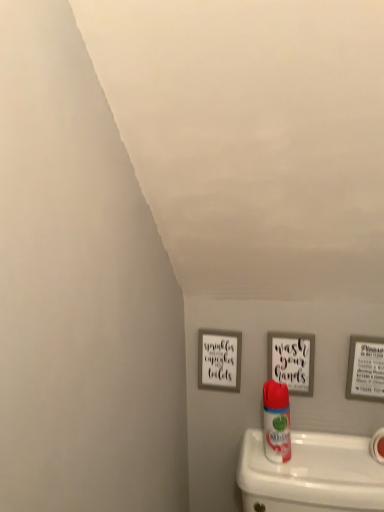
Question: From a real-world perspective, does wooden sign at center, which is the second picture frame from left to right, sit lower than white glossy air freshener at center?

Choices:
 (A) no
 (B) yes

Answer: (A)

Question: Does wooden sign at center, acting as the second picture frame starting from the right, appear on the left side of white glossy air freshener at center?

Choices:
 (A) yes
 (B) no

Answer: (B)

Question: From the image's perspective, does wooden sign at center, acting as the second picture frame starting from the right, appear lower than white glossy air freshener at center?

Choices:
 (A) no
 (B) yes

Answer: (A)

Question: Is wooden sign at center, which is the second picture frame from left to right, next to white glossy air freshener at center and touching it?

Choices:
 (A) no
 (B) yes

Answer: (A)

Question: From the image's perspective, is wooden sign at center, which is the second picture frame from left to right, on white glossy air freshener at center?

Choices:
 (A) yes
 (B) no

Answer: (A)

Question: Is white glossy air freshener at center to the left or to the right of matte gray picture frame at right, which ranks as the 3th picture frame in left-to-right order, in the image?

Choices:
 (A) left
 (B) right

Answer: (A)

Question: Is point (276, 459) closer or farther from the camera than point (377, 349)?

Choices:
 (A) farther
 (B) closer

Answer: (B)

Question: Is white glossy air freshener at center wider or thinner than matte gray picture frame at right, which ranks as the 3th picture frame in left-to-right order?

Choices:
 (A) thin
 (B) wide

Answer: (B)

Question: From a real-world perspective, is white glossy air freshener at center physically located above or below matte gray picture frame at right, which ranks as the 3th picture frame in left-to-right order?

Choices:
 (A) below
 (B) above

Answer: (A)

Question: From a real-world perspective, relative to wooden sign at center, acting as the second picture frame starting from the right, is white matte toilet paper at lower right vertically above or below?

Choices:
 (A) below
 (B) above

Answer: (A)

Question: Is white matte toilet paper at lower right spatially inside wooden sign at center, which is the second picture frame from left to right, or outside of it?

Choices:
 (A) outside
 (B) inside

Answer: (A)

Question: In terms of height, does white matte toilet paper at lower right look taller or shorter compared to wooden sign at center, acting as the second picture frame starting from the right?

Choices:
 (A) short
 (B) tall

Answer: (A)

Question: In terms of size, does white matte toilet paper at lower right appear bigger or smaller than wooden sign at center, acting as the second picture frame starting from the right?

Choices:
 (A) small
 (B) big

Answer: (A)

Question: From the image's perspective, is white matte toilet paper at lower right located above or below matte gray picture frame at right, which ranks as the 3th picture frame in left-to-right order?

Choices:
 (A) below
 (B) above

Answer: (A)

Question: Looking at the image, does white matte toilet paper at lower right seem bigger or smaller compared to matte gray picture frame at right, which ranks as the 3th picture frame in left-to-right order?

Choices:
 (A) small
 (B) big

Answer: (A)